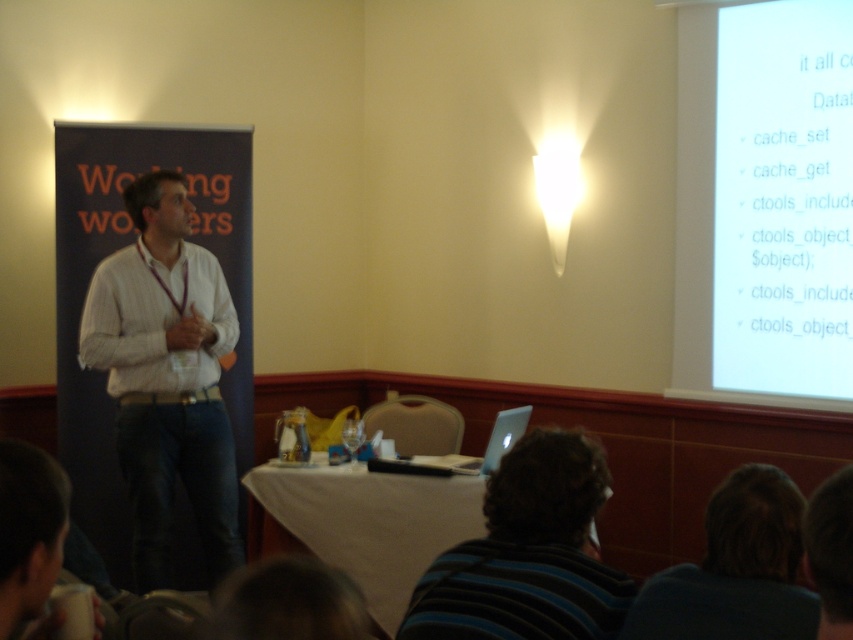
Question: Does white glossy projector screen at upper right lie in front of white striped shirt at center?

Choices:
 (A) no
 (B) yes

Answer: (A)

Question: Which point is closer to the camera?

Choices:
 (A) dark brown hair at upper center
 (B) white striped shirt at center

Answer: (A)

Question: Which object is farther from the camera taking this photo?

Choices:
 (A) white striped shirt at center
 (B) white cloth at center
 (C) dark brown hair at upper center
 (D) white glossy projector screen at upper right

Answer: (D)

Question: Which point appears farthest from the camera in this image?

Choices:
 (A) (776, 520)
 (B) (408, 481)

Answer: (B)

Question: Is white striped shirt at center smaller than white cloth at center?

Choices:
 (A) yes
 (B) no

Answer: (A)

Question: Can you confirm if white striped shirt at center is thinner than dark brown hair at upper center?

Choices:
 (A) yes
 (B) no

Answer: (B)